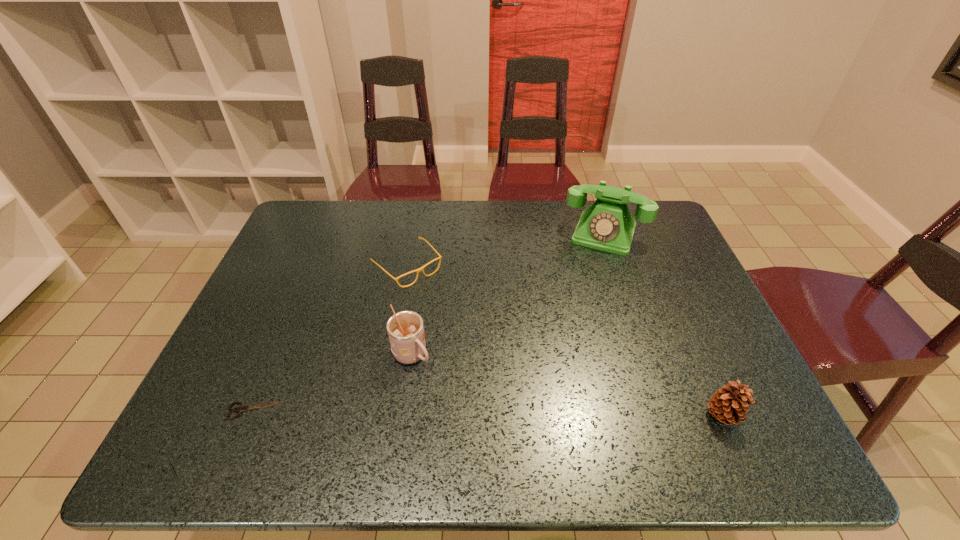
Locate an element on the screen. vacant space located 0.390m on the dial of the telephone is located at coordinates (564, 350).

Locate an element on the screen. This screenshot has height=540, width=960. vacant area situated 0.120m on the dial of the telephone is located at coordinates (588, 280).

You are a GUI agent. You are given a task and a screenshot of the screen. Output one action in this format:
    pyautogui.click(x=<x>, y=<y>)
    Task: Click on the vacant region located 0.220m on the dial of the telephone
    
    Given the screenshot: What is the action you would take?
    pyautogui.click(x=580, y=303)

The height and width of the screenshot is (540, 960). Identify the location of vacant region located in front of the lenses of the fourth tallest object. (458, 317).

Identify the location of vacant space located 0.340m in front of the lenses of the fourth tallest object. This screenshot has width=960, height=540. (506, 364).

Find the location of a particular element. free space located 0.190m in front of the lenses of the fourth tallest object is located at coordinates (468, 326).

Find the location of `object that is at the far edge`. object that is at the far edge is located at coordinates (607, 225).

Where is `shears positioned at the near edge`? The height and width of the screenshot is (540, 960). shears positioned at the near edge is located at coordinates (240, 409).

You are a GUI agent. You are given a task and a screenshot of the screen. Output one action in this format:
    pyautogui.click(x=<x>, y=<y>)
    Task: Click on the pinecone at the near edge
    This screenshot has height=540, width=960.
    Given the screenshot: What is the action you would take?
    pyautogui.click(x=729, y=405)

You are a GUI agent. You are given a task and a screenshot of the screen. Output one action in this format:
    pyautogui.click(x=<x>, y=<y>)
    Task: Click on the object present at the left edge
    Image resolution: width=960 pixels, height=540 pixels.
    Given the screenshot: What is the action you would take?
    pyautogui.click(x=240, y=409)